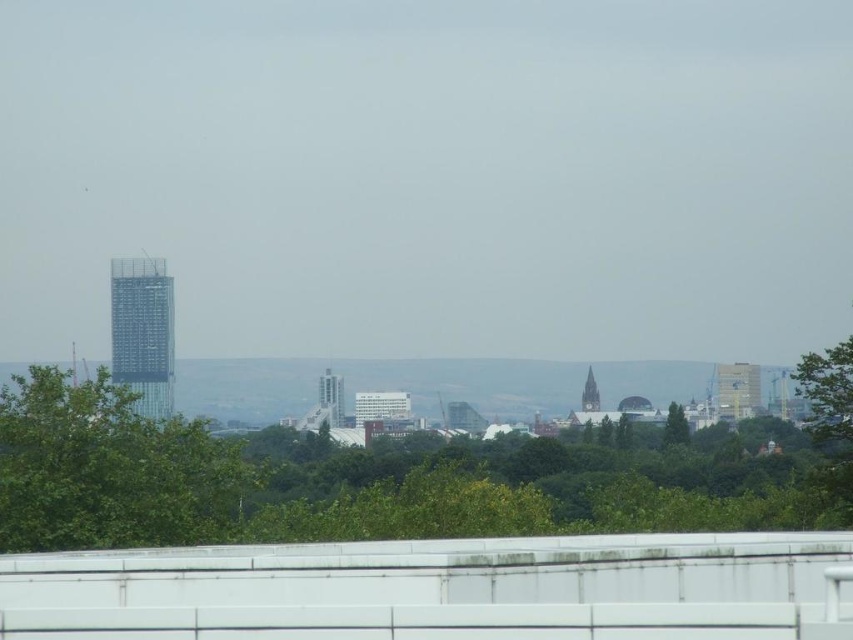
Looking at this image, who is higher up, green leafy tree at lower center or green leafy tree at left?

green leafy tree at left is higher up.

Can you confirm if green leafy tree at lower center is bigger than green leafy tree at left?

Indeed, green leafy tree at lower center has a larger size compared to green leafy tree at left.

You are a GUI agent. You are given a task and a screenshot of the screen. Output one action in this format:
    pyautogui.click(x=<x>, y=<y>)
    Task: Click on the green leafy tree at lower center
    The width and height of the screenshot is (853, 640).
    Given the screenshot: What is the action you would take?
    pyautogui.click(x=374, y=480)

Can you confirm if green leafy tree at right is positioned above green leafy tree at center?

Yes.

Can you confirm if green leafy tree at right is positioned below green leafy tree at center?

No.

Does point (834, 429) come in front of point (669, 429)?

That is True.

Where is `green leafy tree at right`? green leafy tree at right is located at coordinates (827, 388).

From the picture: Does green leafy tree at lower center appear on the right side of green leafy tree at right?

Incorrect, green leafy tree at lower center is not on the right side of green leafy tree at right.

Does green leafy tree at lower center have a lesser width compared to green leafy tree at right?

Incorrect, green leafy tree at lower center's width is not less than green leafy tree at right's.

Between point (833, 493) and point (828, 438), which one is positioned behind?

The point (828, 438) is behind.

Where is `green leafy tree at lower center`? This screenshot has height=640, width=853. green leafy tree at lower center is located at coordinates (374, 480).